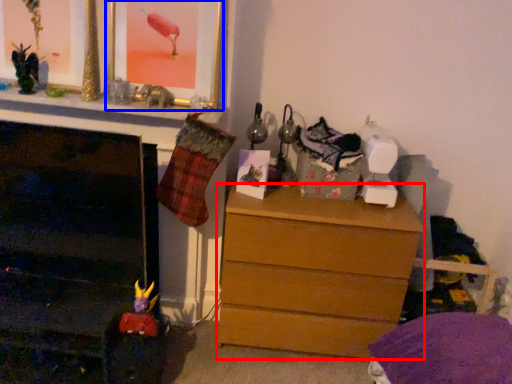
Question: Which point is further to the camera, chest of drawers (highlighted by a red box) or picture frame (highlighted by a blue box)?

Choices:
 (A) chest of drawers
 (B) picture frame

Answer: (A)